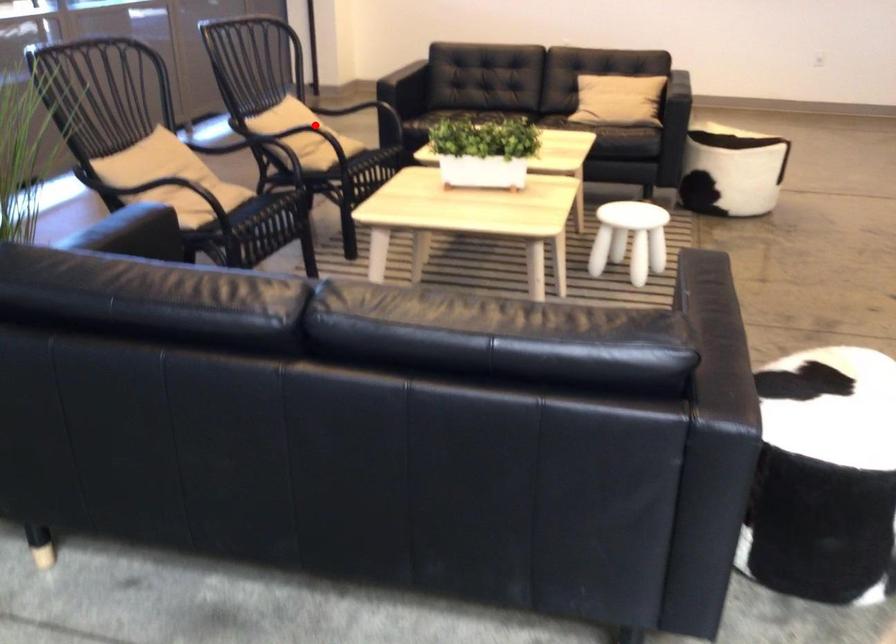
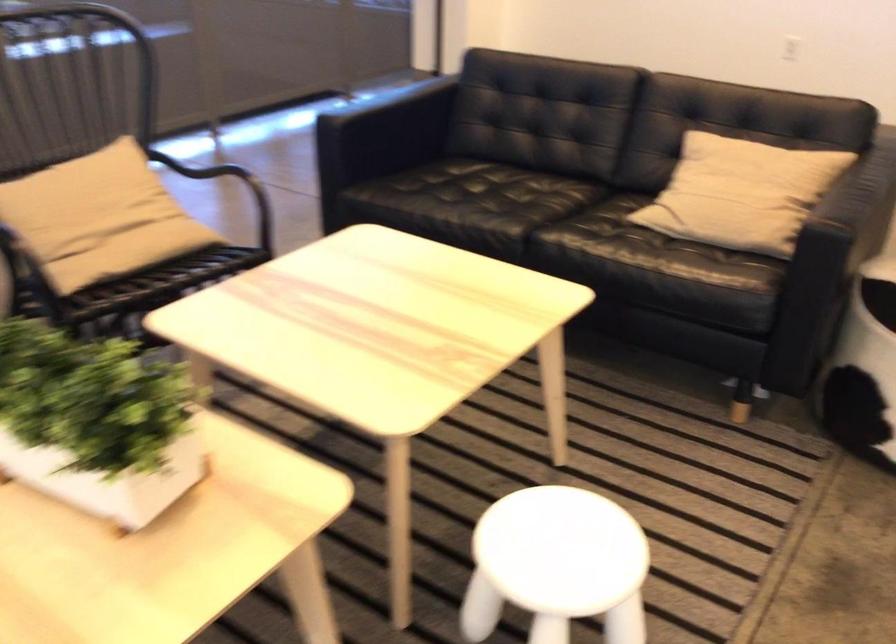
Question: I am providing you with two images of the same scene from different viewpoints. A red point is shown in image1. For the corresponding object point in image2, is it positioned nearer or farther from the camera?

Choices:
 (A) Nearer
 (B) Farther

Answer: (A)